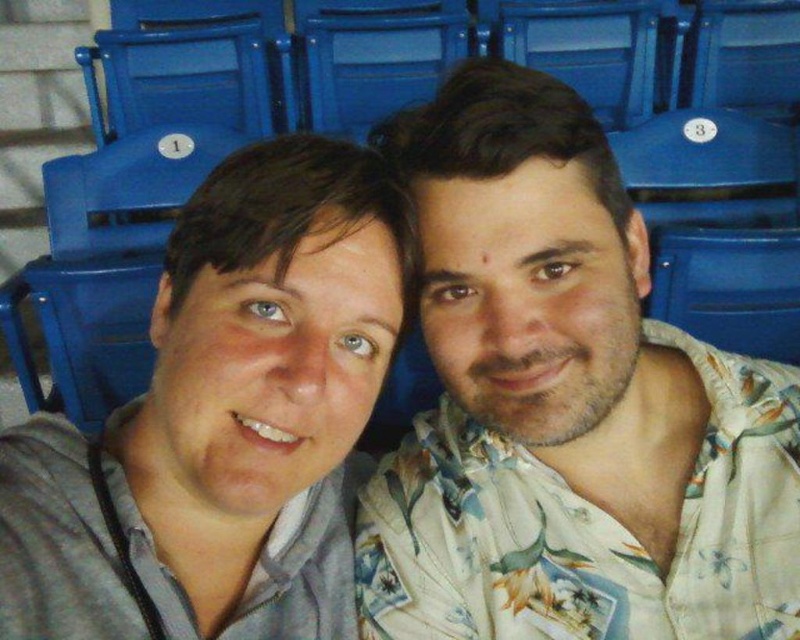
Question: Which point appears closest to the camera in this image?

Choices:
 (A) tap(566, 65)
 (B) tap(545, 326)
 (C) tap(366, 22)
 (D) tap(158, 556)

Answer: (B)

Question: Does floral print shirt at center have a larger size compared to blue plastic chair at center?

Choices:
 (A) no
 (B) yes

Answer: (A)

Question: Does floral print shirt at center lie in front of blue plastic chair at center?

Choices:
 (A) no
 (B) yes

Answer: (B)

Question: Based on their relative distances, which object is nearer to the floral print shirt at center?

Choices:
 (A) blue plastic chair at upper center
 (B) floral shirt at center
 (C) blue plastic chair at center

Answer: (B)

Question: Observing the image, what is the correct spatial positioning of floral print shirt at center in reference to blue plastic chair at upper center?

Choices:
 (A) below
 (B) above

Answer: (A)

Question: Which object is the farthest from the blue plastic chair at upper center?

Choices:
 (A) floral shirt at center
 (B) blue plastic chair at center
 (C) floral print shirt at center

Answer: (A)